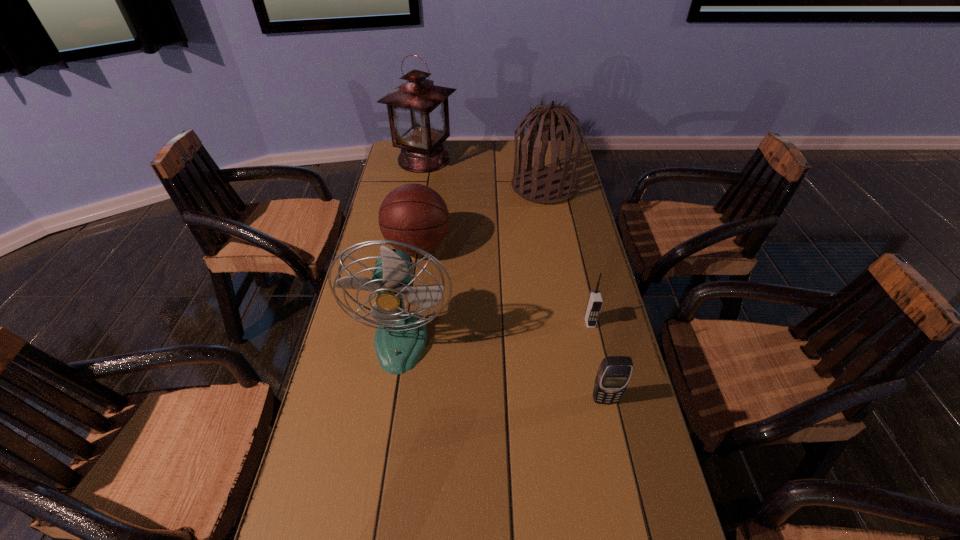
At what (x,y) coordinates should I click in order to perform the action: click on oil lamp. Please return your answer as a coordinate pair (x, y). Looking at the image, I should click on (418, 111).

Locate an element on the screen. fan is located at coordinates (401, 336).

The image size is (960, 540). I want to click on birdcage, so click(545, 185).

Where is `basketball`? This screenshot has width=960, height=540. basketball is located at coordinates (415, 214).

Where is `the third farthest object`? This screenshot has height=540, width=960. the third farthest object is located at coordinates (415, 214).

Locate an element on the screen. This screenshot has height=540, width=960. the farther cellular telephone is located at coordinates (594, 305).

Image resolution: width=960 pixels, height=540 pixels. What are the coordinates of `the nearest object` in the screenshot? It's located at (614, 373).

I want to click on vacant space situated on the right of the oil lamp, so click(x=507, y=159).

Locate an element on the screen. vacant space located in front of the fan, directing airflow is located at coordinates pyautogui.click(x=387, y=431).

Locate an element on the screen. vacant position located on the front of the birdcage is located at coordinates (553, 238).